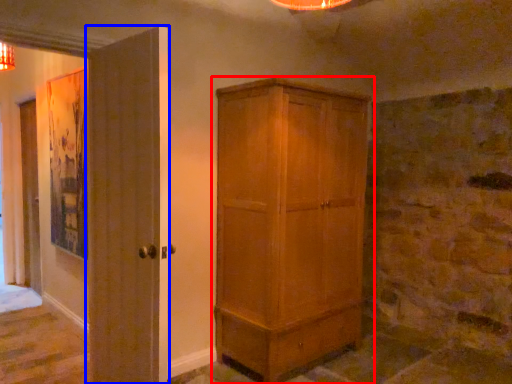
Question: Which of the following is the farthest to the observer, cupboard (highlighted by a red box) or door (highlighted by a blue box)?

Choices:
 (A) cupboard
 (B) door

Answer: (A)